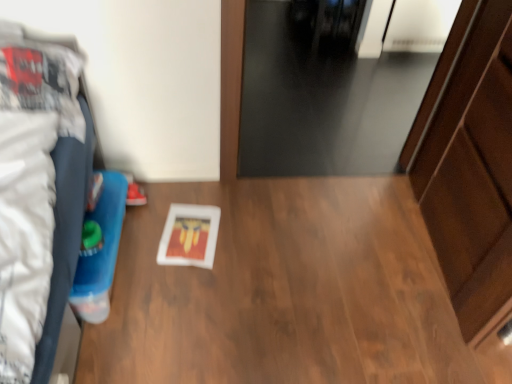
The height and width of the screenshot is (384, 512). Identify the location of vacant area that is situated to the right of matte red shoe at lower left. (178, 203).